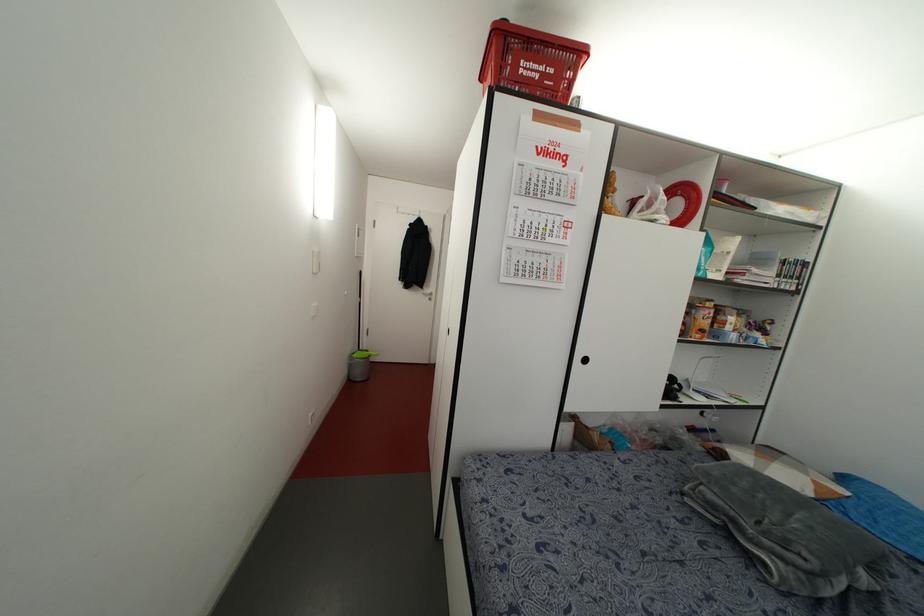
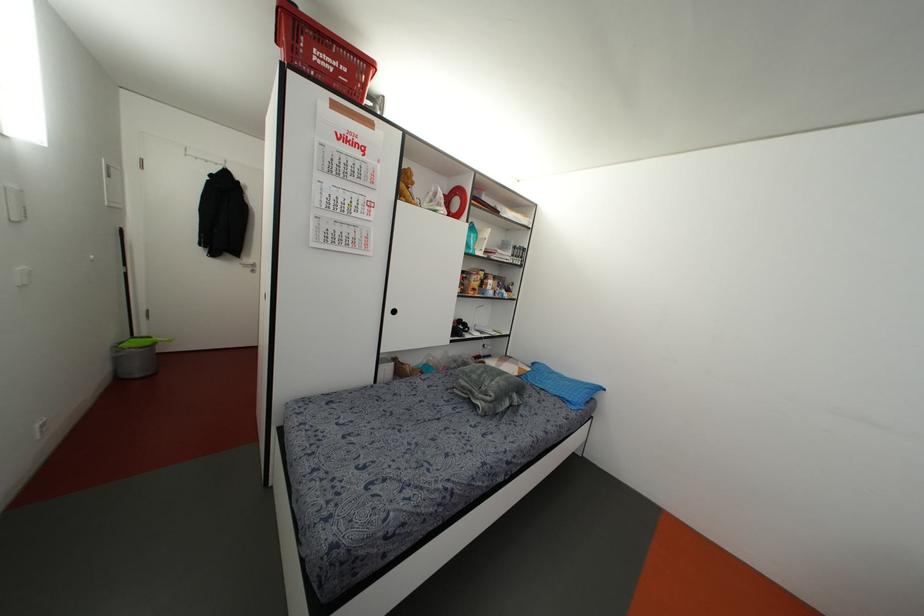
The point at (369, 355) is marked in the first image. Where is the corresponding point in the second image?

(153, 342)